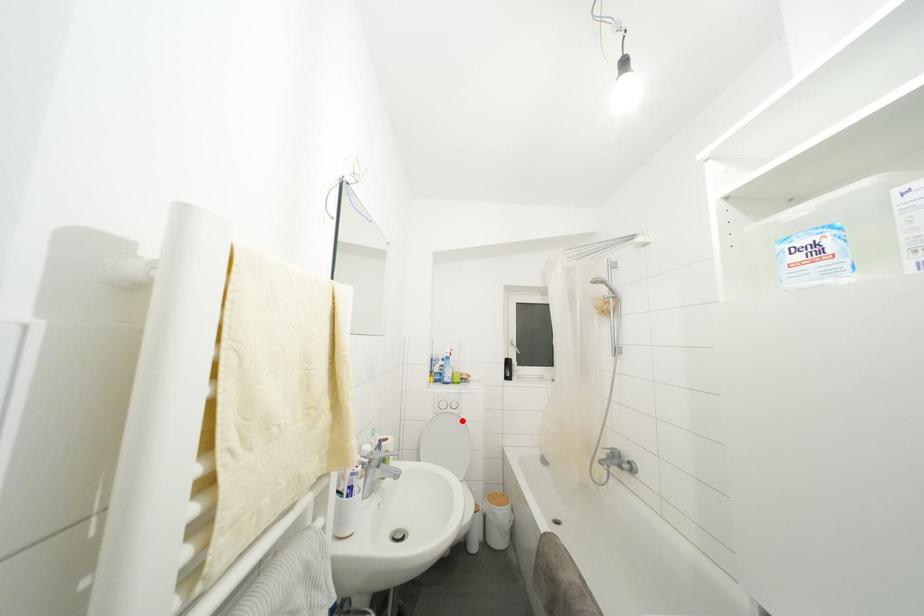
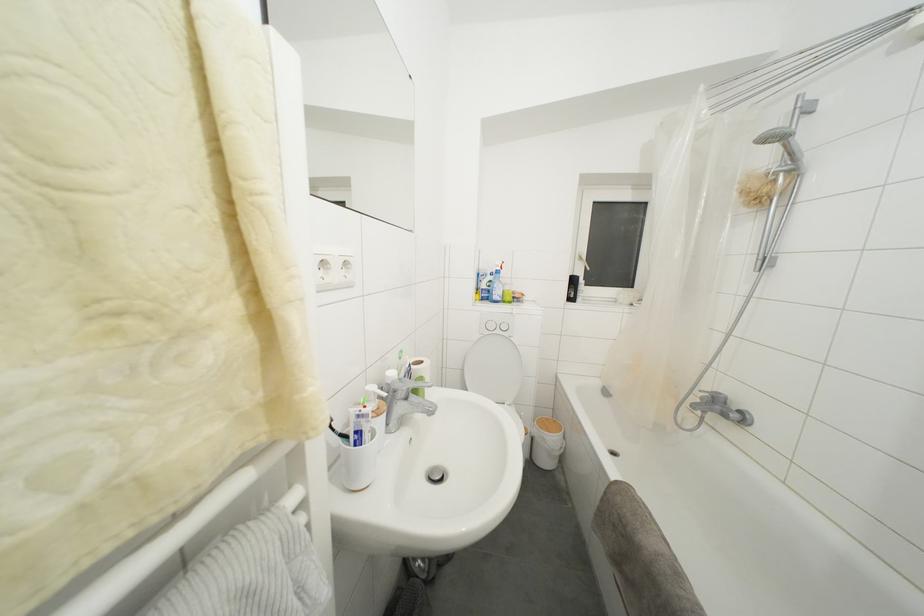
Where in the second image is the point corresponding to the highlighted location from the first image?

(513, 344)